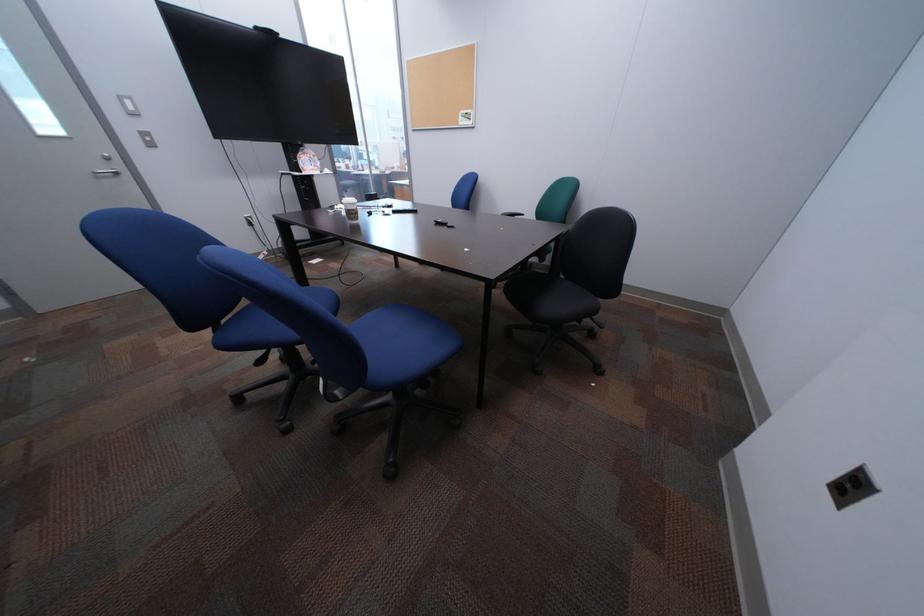
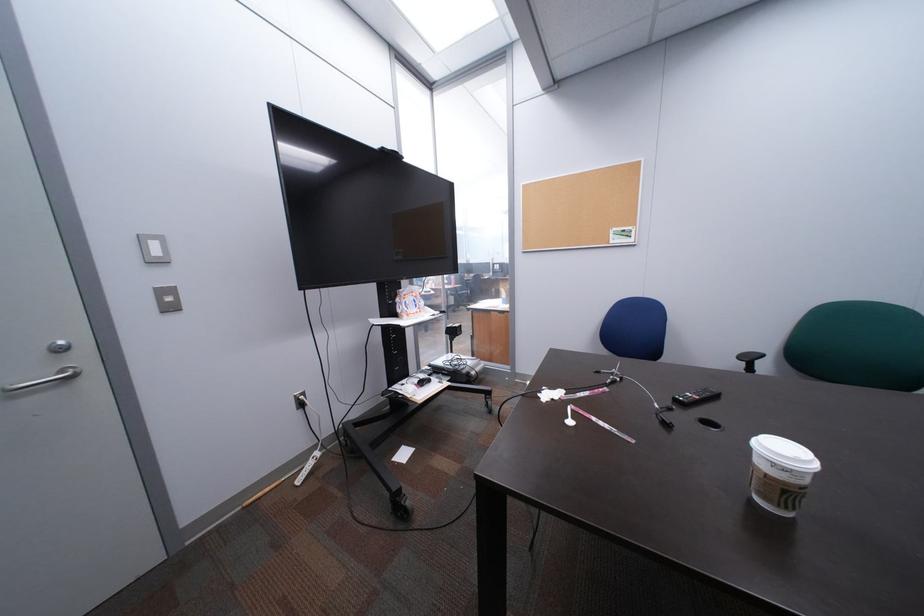
In a continuous first-person perspective shot, in which direction is the camera moving?

The movement direction of the cameraman is left, forward.